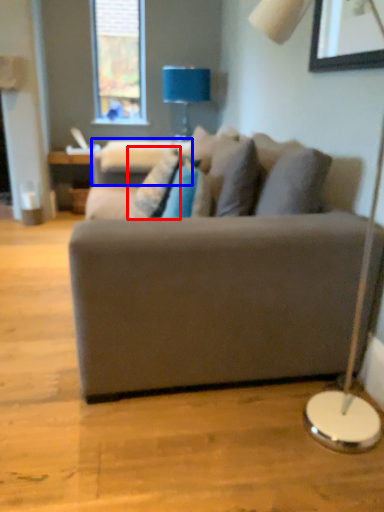
Question: Which point is closer to the camera, pillow (highlighted by a red box) or swivel chair (highlighted by a blue box)?

Choices:
 (A) pillow
 (B) swivel chair

Answer: (A)